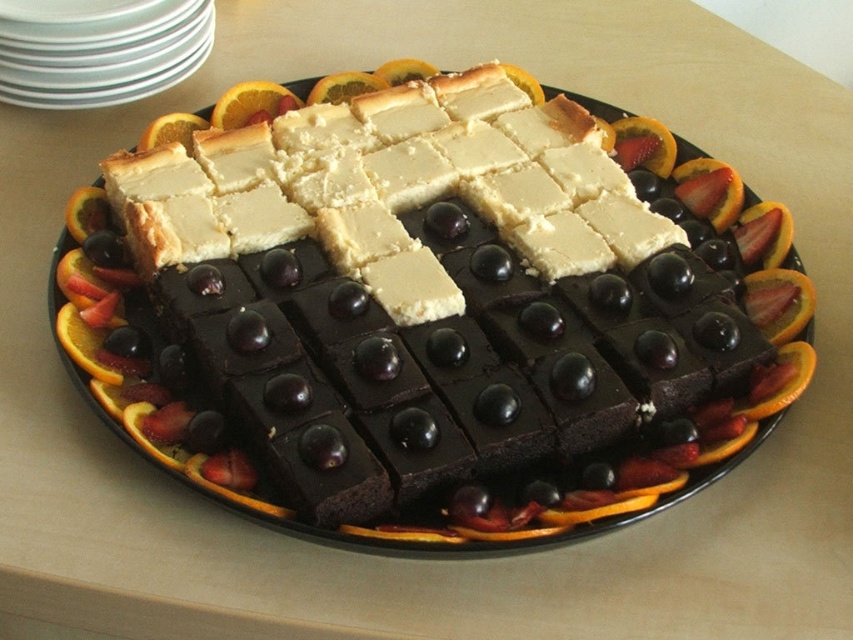
You are a dessert artist trying to place a cherry on the platter. You have two points to choose from, point [213,112] and point [160,131]. Which point is closer to the front of the platter?

Point [160,131] is closer to the front of the platter because it is in front of point [213,112].

You are a dessert server who needs to place an orange peel on a plate. Given the white glossy plates at upper left and the orange peel at upper left, which plate can accommodate the orange peel without it hanging off the edge?

The white glossy plates at upper left is wider than the orange peel at upper left, so placing the orange peel on the white glossy plates at upper left would ensure it fits without hanging off the edge.

You are a food stylist arranging desserts on a platter. You have a white glossy plates at upper left and orangesmoothfruit at upper left. The distance between them is 6.96 inches. If you need to place a decorative napkin that must be at least 7 inches away from both items, where should you place it?

The decorative napkin should be placed outside the platter because the minimum required distance of 7 inches from both the white glossy plates at upper left and orangesmoothfruit at upper left cannot be achieved within the current arrangement where they are only 6.96 inches apart.